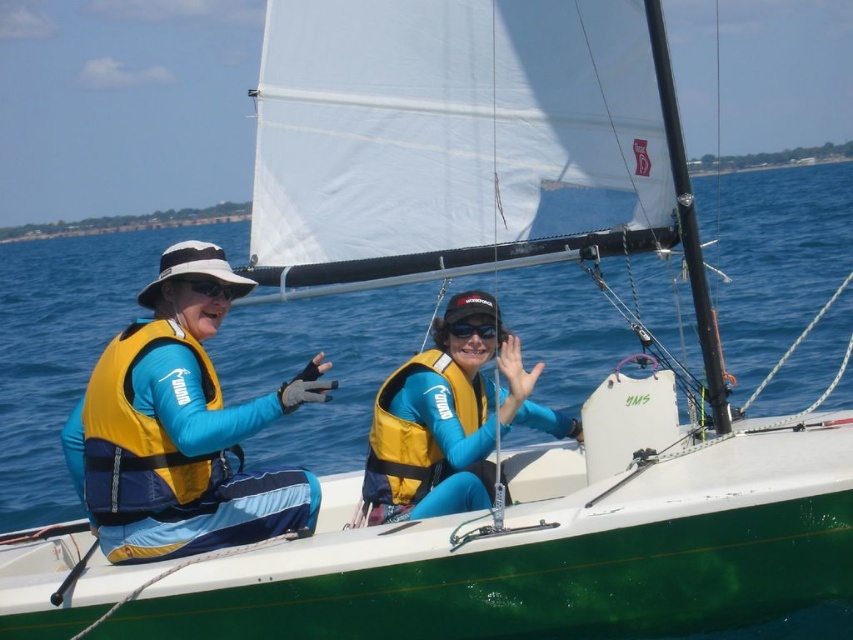
Can you confirm if yellow life jacket at center is positioned to the left of black matte goggles at center?

Correct, you'll find yellow life jacket at center to the left of black matte goggles at center.

Is point (396, 420) positioned after point (463, 330)?

Yes, it is.

Where is `yellow life jacket at center`? Image resolution: width=853 pixels, height=640 pixels. yellow life jacket at center is located at coordinates (415, 435).

From the picture: Is yellow life jacket at center positioned at the back of black matte sunglasses at left?

Yes.

What do you see at coordinates (415, 435) in the screenshot? The image size is (853, 640). I see `yellow life jacket at center` at bounding box center [415, 435].

The height and width of the screenshot is (640, 853). Find the location of `yellow life jacket at center`. yellow life jacket at center is located at coordinates (415, 435).

How much distance is there between black matte goggles at center and black matte sunglasses at left?

black matte goggles at center is 1.24 meters from black matte sunglasses at left.

Is black matte goggles at center smaller than black matte sunglasses at left?

Yes, black matte goggles at center is smaller than black matte sunglasses at left.

Is point (460, 333) positioned in front of point (209, 291)?

No, it is behind (209, 291).

Image resolution: width=853 pixels, height=640 pixels. I want to click on black matte goggles at center, so click(x=474, y=328).